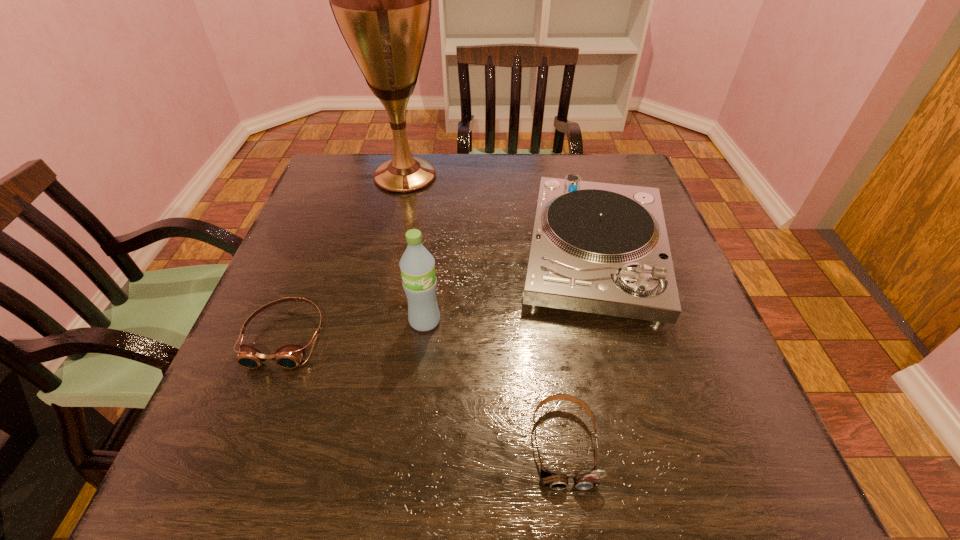
This screenshot has height=540, width=960. What are the coordinates of `free space between the farther goggles and the trophy cup` in the screenshot? It's located at (346, 256).

Identify the location of unoccupied area between the fourth shortest object and the third shortest object. The width and height of the screenshot is (960, 540). 510,288.

What are the coordinates of `free spot between the third shortest object and the trophy cup` in the screenshot? It's located at (500, 215).

What are the coordinates of `vacant point located between the tallest object and the left goggles` in the screenshot? It's located at (346, 256).

This screenshot has width=960, height=540. I want to click on free space between the water bottle and the record player, so click(510, 288).

At what (x,y) coordinates should I click in order to perform the action: click on empty location between the farther goggles and the trophy cup. Please return your answer as a coordinate pair (x, y). The image size is (960, 540). Looking at the image, I should click on (346, 256).

Choose which object is the second nearest neighbor to the third tallest object. Please provide its 2D coordinates. Your answer should be formatted as a tuple, i.e. [(x, y)], where the tuple contains the x and y coordinates of a point satisfying the conditions above.

[(417, 265)]

Locate an element on the screen. Image resolution: width=960 pixels, height=540 pixels. the second closest object to the nearer goggles is located at coordinates (417, 265).

In order to click on vacant position in the image that satisfies the following two spatial constraints: 1. on the front side of the tallest object; 2. on the right side of the water bottle in this screenshot , I will do `click(373, 321)`.

Locate an element on the screen. free space that satisfies the following two spatial constraints: 1. on the front side of the tallest object; 2. on the left side of the third shortest object is located at coordinates (388, 255).